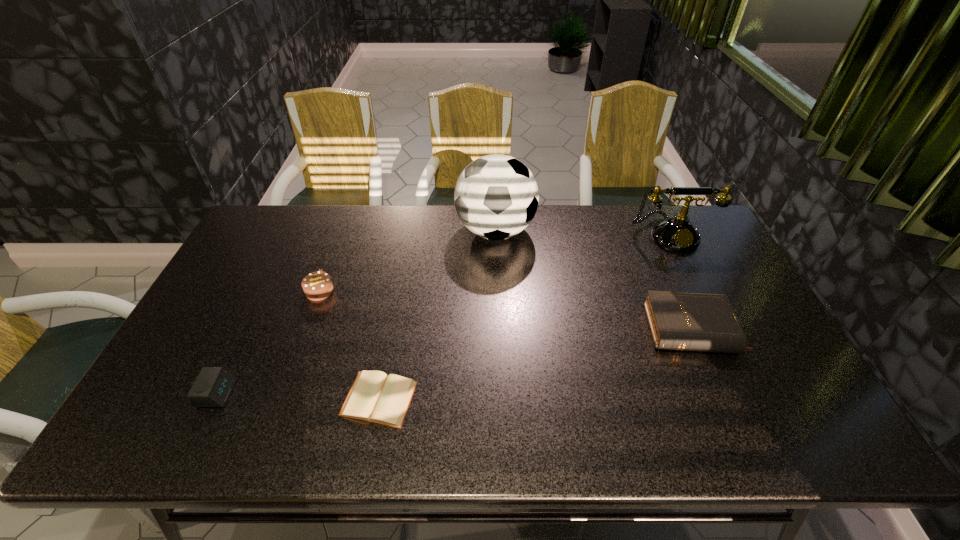
The width and height of the screenshot is (960, 540). I want to click on the tallest object, so click(496, 196).

Locate an element on the screen. The height and width of the screenshot is (540, 960). the fourth object from left to right is located at coordinates (496, 196).

This screenshot has height=540, width=960. Find the location of `telephone`. telephone is located at coordinates (677, 233).

The height and width of the screenshot is (540, 960). In order to click on the fourth nearest object in this screenshot , I will do `click(318, 285)`.

This screenshot has width=960, height=540. In order to click on the second object from left to right in this screenshot , I will do `click(318, 285)`.

Find the location of `Bible`. Bible is located at coordinates (691, 321).

Locate an element on the screen. The width and height of the screenshot is (960, 540). alarm clock is located at coordinates (213, 385).

Locate an element on the screen. the shortest object is located at coordinates (375, 397).

Image resolution: width=960 pixels, height=540 pixels. In order to click on the third object from left to right in this screenshot , I will do `click(375, 397)`.

Find the location of a particular element. vacant space located 0.240m on the main logo of the tallest object is located at coordinates (386, 231).